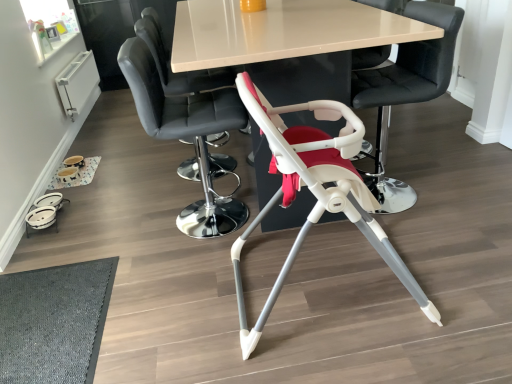
Find the location of `free space above dark gray textured mat at lower left (from a real-world perspective)`. free space above dark gray textured mat at lower left (from a real-world perspective) is located at coordinates (46, 316).